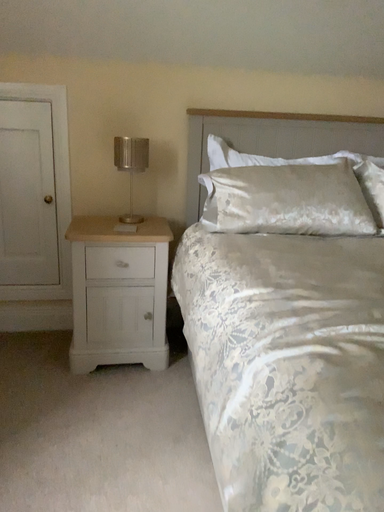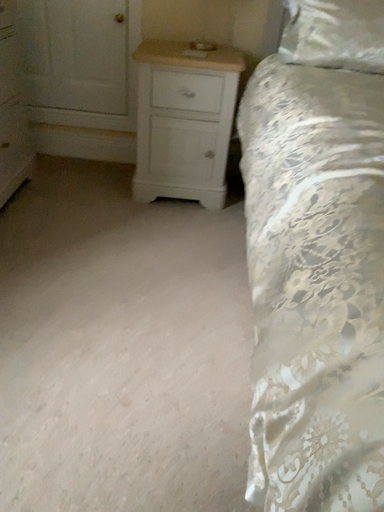
Question: How did the camera likely rotate when shooting the video?

Choices:
 (A) rotated right
 (B) rotated left

Answer: (B)